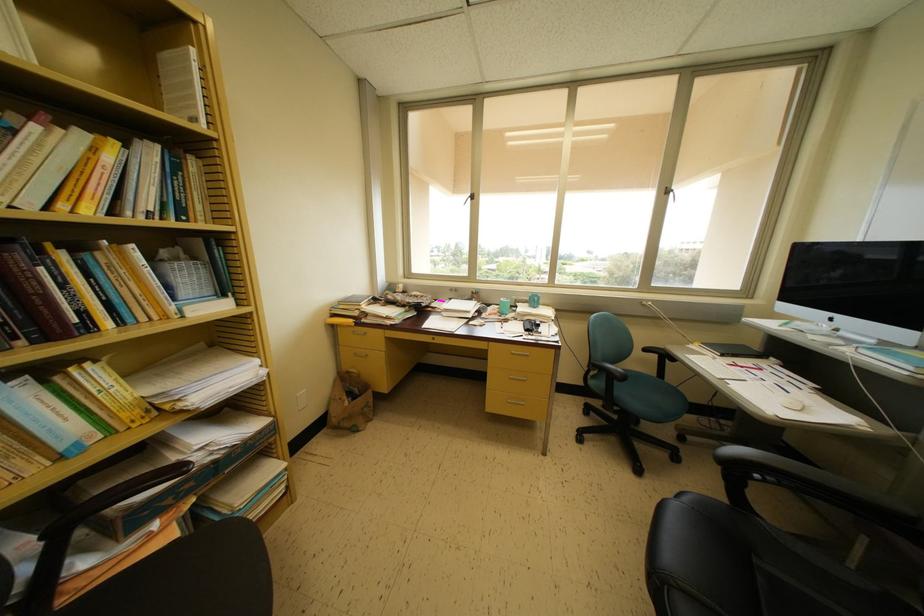
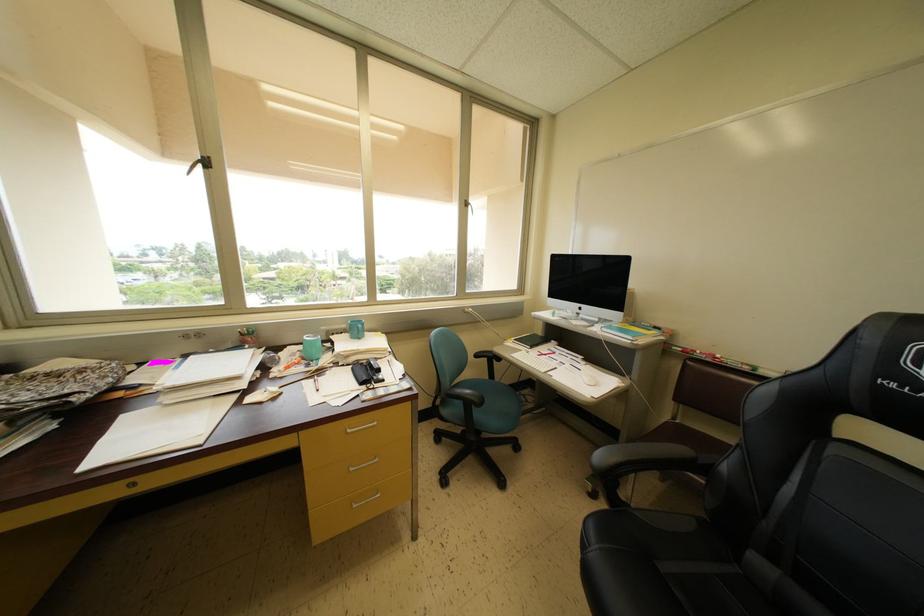
Question: The images are taken continuously from a first-person perspective. In which direction is your viewpoint rotating?

Choices:
 (A) Left
 (B) Right
 (C) Up
 (D) Down

Answer: (B)